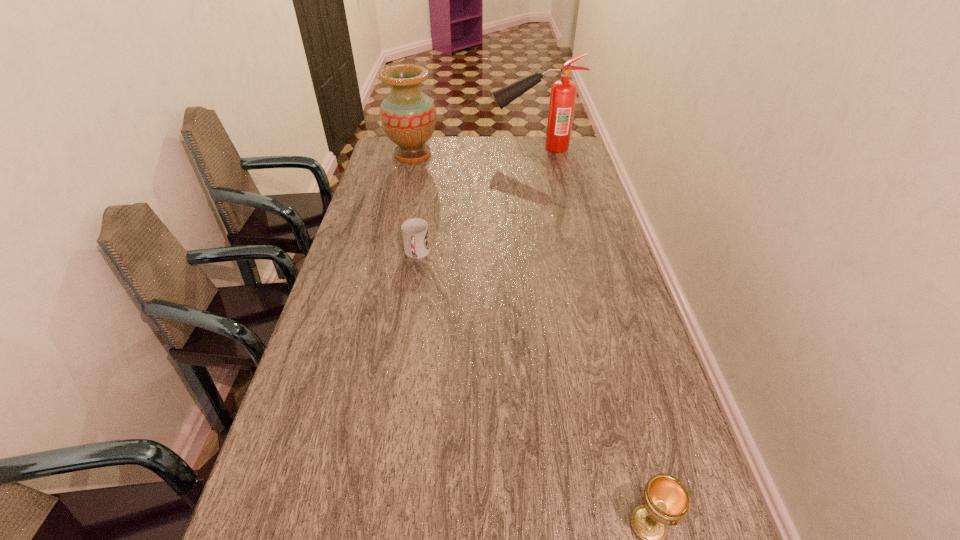
The width and height of the screenshot is (960, 540). Identify the location of empty space between the cup and the fire extinguisher. (476, 201).

You are a GUI agent. You are given a task and a screenshot of the screen. Output one action in this format:
    pyautogui.click(x=<x>, y=<y>)
    Task: Click on the empty space between the second nearest object and the vase
    
    Given the screenshot: What is the action you would take?
    pyautogui.click(x=415, y=204)

This screenshot has width=960, height=540. I want to click on free space between the fire extinguisher and the vase, so click(x=473, y=151).

Identify the location of free point between the shortest object and the fire extinguisher. (476, 201).

This screenshot has width=960, height=540. Find the location of `unoccupied position between the cup and the fire extinguisher`. unoccupied position between the cup and the fire extinguisher is located at coordinates (476, 201).

Choose which object is the second nearest neighbor to the vase. Please provide its 2D coordinates. Your answer should be formatted as a tuple, i.e. [(x, y)], where the tuple contains the x and y coordinates of a point satisfying the conditions above.

[(415, 232)]

This screenshot has height=540, width=960. Identify the location of object that ranks as the closest to the fire extinguisher. (408, 116).

Identify the location of free location that satisfies the following two spatial constraints: 1. at the nozzle of the fire extinguisher; 2. on the side of the cup where the handle is located. click(555, 254).

You are a GUI agent. You are given a task and a screenshot of the screen. Output one action in this format:
    pyautogui.click(x=<x>, y=<y>)
    Task: Click on the vacant area that satisfies the following two spatial constraints: 1. at the nozzle of the fire extinguisher; 2. on the side of the cup where the handle is located
    
    Given the screenshot: What is the action you would take?
    pos(555,254)

Image resolution: width=960 pixels, height=540 pixels. What are the coordinates of `free location that satisfies the following two spatial constraints: 1. at the nozzle of the fire extinguisher; 2. on the side of the second nearest object where the handle is located` in the screenshot? It's located at (555, 254).